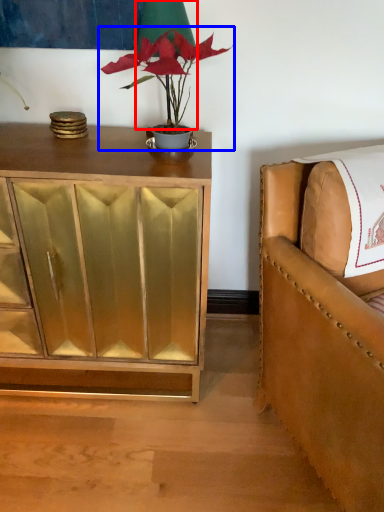
Question: Which object appears closest to the camera in this image, table lamp (highlighted by a red box) or houseplant (highlighted by a blue box)?

Choices:
 (A) table lamp
 (B) houseplant

Answer: (B)